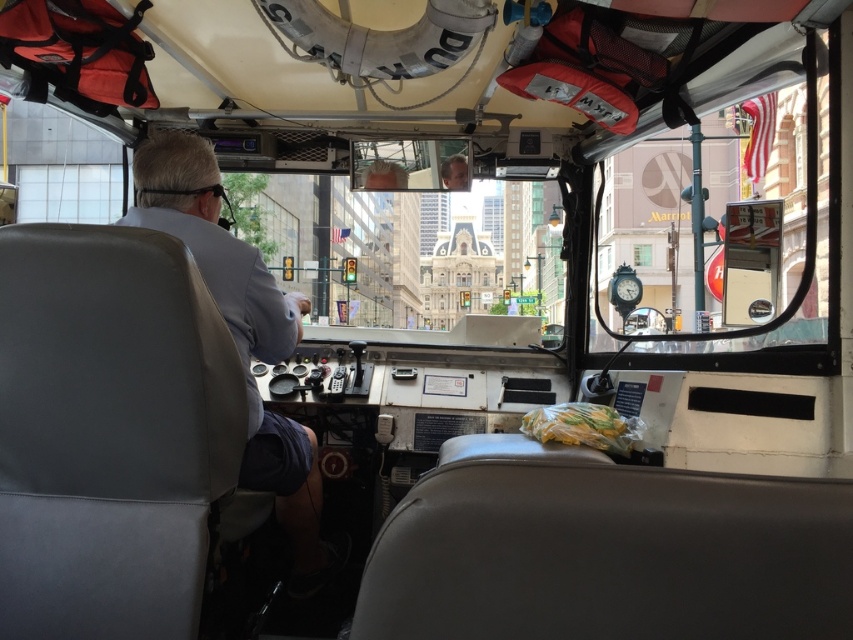
Question: Which point is farther to the camera?

Choices:
 (A) white leather jacket at left
 (B) clear glass window at center

Answer: (B)

Question: Which point is farther to the camera?

Choices:
 (A) (634, 260)
 (B) (286, 342)

Answer: (A)

Question: Is white leather jacket at left above clear glass window at center?

Choices:
 (A) yes
 (B) no

Answer: (B)

Question: Does white leather jacket at left have a greater width compared to clear glass window at center?

Choices:
 (A) no
 (B) yes

Answer: (A)

Question: Is white leather jacket at left smaller than clear glass window at center?

Choices:
 (A) yes
 (B) no

Answer: (B)